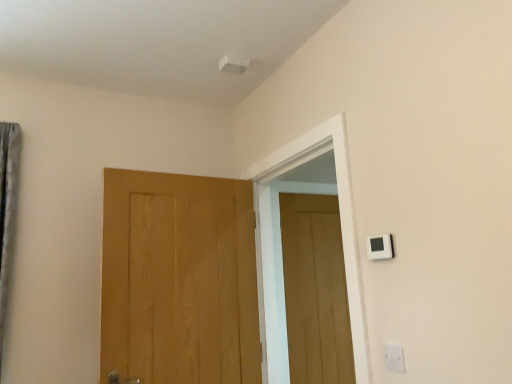
Question: From a real-world perspective, is white plastic light switch at upper right under light brown wood door at center, the 1th door viewed from the front?

Choices:
 (A) no
 (B) yes

Answer: (A)

Question: Is white plastic light switch at upper right wider than light brown wood door at center, the second door from the back?

Choices:
 (A) no
 (B) yes

Answer: (A)

Question: Are white plastic light switch at upper right and light brown wood door at center, which is the second door from right to left, located far from each other?

Choices:
 (A) yes
 (B) no

Answer: (A)

Question: Is white plastic light switch at upper right shorter than light brown wood door at center, the 1th door viewed from the front?

Choices:
 (A) yes
 (B) no

Answer: (A)

Question: Is white plastic light switch at upper right facing away from light brown wood door at center, which is the second door from right to left?

Choices:
 (A) yes
 (B) no

Answer: (B)

Question: Considering the positions of point (239, 380) and point (380, 246), is point (239, 380) closer or farther from the camera than point (380, 246)?

Choices:
 (A) farther
 (B) closer

Answer: (A)

Question: From the image's perspective, is light brown wood door at center, which appears as the first door when viewed from the left, located above or below white plastic light switch at upper right?

Choices:
 (A) below
 (B) above

Answer: (A)

Question: Considering the positions of light brown wood door at center, which appears as the first door when viewed from the left, and white plastic light switch at upper right in the image, is light brown wood door at center, which appears as the first door when viewed from the left, taller or shorter than white plastic light switch at upper right?

Choices:
 (A) short
 (B) tall

Answer: (B)

Question: Is light brown wood door at center, which appears as the first door when viewed from the left, wider or thinner than white plastic light switch at upper right?

Choices:
 (A) thin
 (B) wide

Answer: (B)

Question: From a real-world perspective, is white plastic light switch at upper right positioned above or below white plastic electric outlet at lower right?

Choices:
 (A) below
 (B) above

Answer: (B)

Question: Is white plastic light switch at upper right situated inside white plastic electric outlet at lower right or outside?

Choices:
 (A) outside
 (B) inside

Answer: (A)

Question: Is point (376, 236) closer or farther from the camera than point (388, 354)?

Choices:
 (A) farther
 (B) closer

Answer: (A)

Question: Considering their positions, is white plastic light switch at upper right located in front of or behind white plastic electric outlet at lower right?

Choices:
 (A) behind
 (B) front

Answer: (A)

Question: Considering the positions of point (196, 226) and point (328, 244), is point (196, 226) closer or farther from the camera than point (328, 244)?

Choices:
 (A) farther
 (B) closer

Answer: (B)

Question: Is light brown wood door at center, the second door from the back, inside the boundaries of wooden door at center, the first door positioned from the back, or outside?

Choices:
 (A) outside
 (B) inside

Answer: (A)